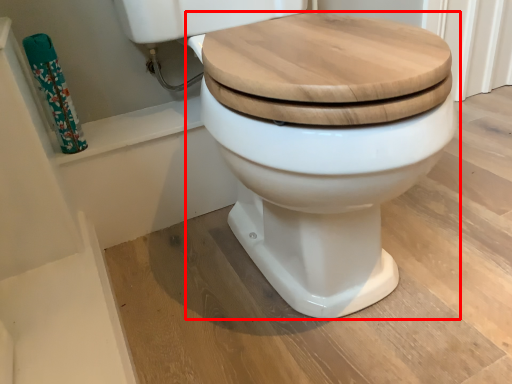
Question: Where is toilet (annotated by the red box) located in relation to toilet paper in the image?

Choices:
 (A) right
 (B) left

Answer: (A)